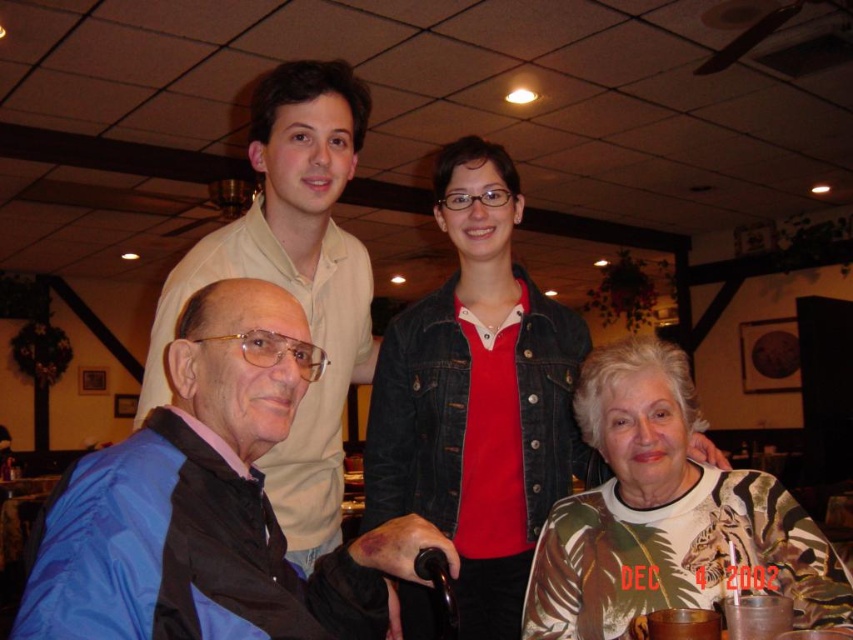
Is point (827, 557) closer to camera compared to point (282, 141)?

Yes, point (827, 557) is in front of point (282, 141).

The height and width of the screenshot is (640, 853). Describe the element at coordinates (668, 516) in the screenshot. I see `printed fabric shirt at center` at that location.

I want to click on printed fabric shirt at center, so click(x=668, y=516).

Is blue fabric at lower left thinner than denim jacket at upper center?

Correct, blue fabric at lower left's width is less than denim jacket at upper center's.

At what (x,y) coordinates should I click in order to perform the action: click on blue fabric at lower left. Please return your answer as a coordinate pair (x, y). This screenshot has height=640, width=853. Looking at the image, I should click on (207, 504).

Locate an element on the screen. Image resolution: width=853 pixels, height=640 pixels. blue fabric at lower left is located at coordinates (207, 504).

Locate an element on the screen. This screenshot has height=640, width=853. blue fabric at lower left is located at coordinates (207, 504).

Is the position of denim jacket at upper center less distant than that of matte beige shirt at upper left?

No.

Consider the image. Is denim jacket at upper center below matte beige shirt at upper left?

Yes, denim jacket at upper center is below matte beige shirt at upper left.

This screenshot has height=640, width=853. What do you see at coordinates (479, 396) in the screenshot?
I see `denim jacket at upper center` at bounding box center [479, 396].

Identify the location of denim jacket at upper center. (479, 396).